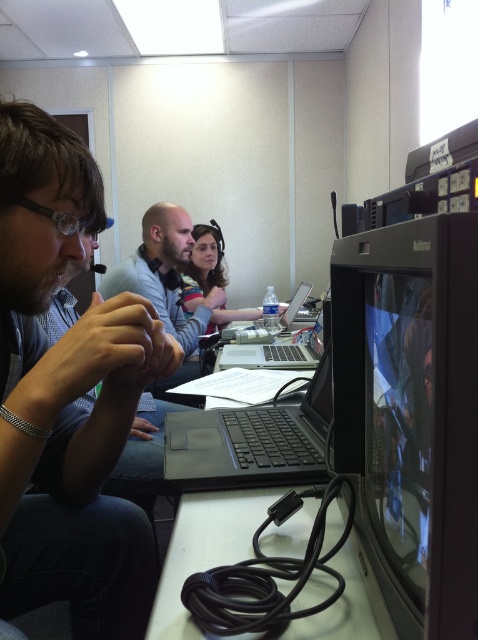
You are setting up a presentation and need to connect your laptop to a monitor. You have a cable that can only reach 1 meter. The distance between the matte black monitor at right and the satin black laptop at center is 1.2 meters. Can you connect them using this cable?

The distance between the matte black monitor at right and the satin black laptop at center is 1.2 meters, which is longer than the 1 meter cable you have. Therefore, you cannot connect them with this cable.

You are standing at the entrance of the conference room and want to approach the smooth gray shirt at center. Based on the coordinates provided, in which direction should you move to reach it?

The smooth gray shirt at center is located at coordinates point (164, 284). Since the coordinate system typically places the origin at the bottom left corner, moving towards the upper right direction from the entrance would lead you to the smooth gray shirt at center.